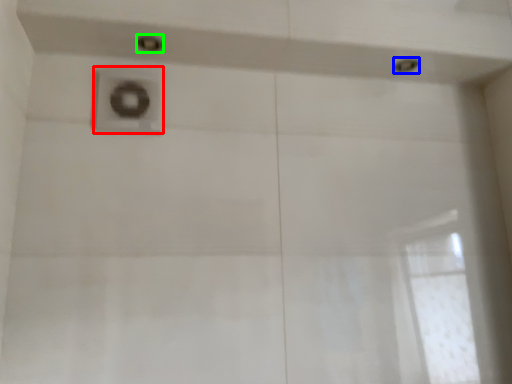
Question: Considering the real-world distances, which object is closest to plumbing fixture (highlighted by a red box)? shower (highlighted by a blue box) or shower (highlighted by a green box).

Choices:
 (A) shower
 (B) shower

Answer: (B)